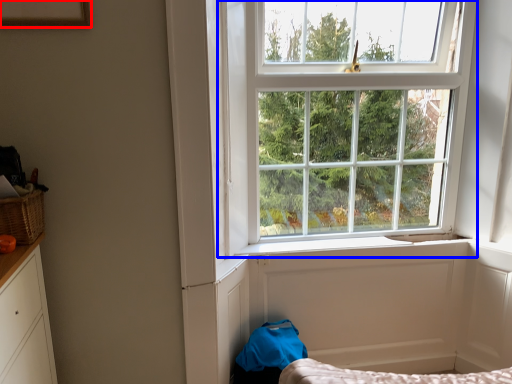
Question: Among these objects, which one is nearest to the camera, picture frame (highlighted by a red box) or window (highlighted by a blue box)?

Choices:
 (A) picture frame
 (B) window

Answer: (A)